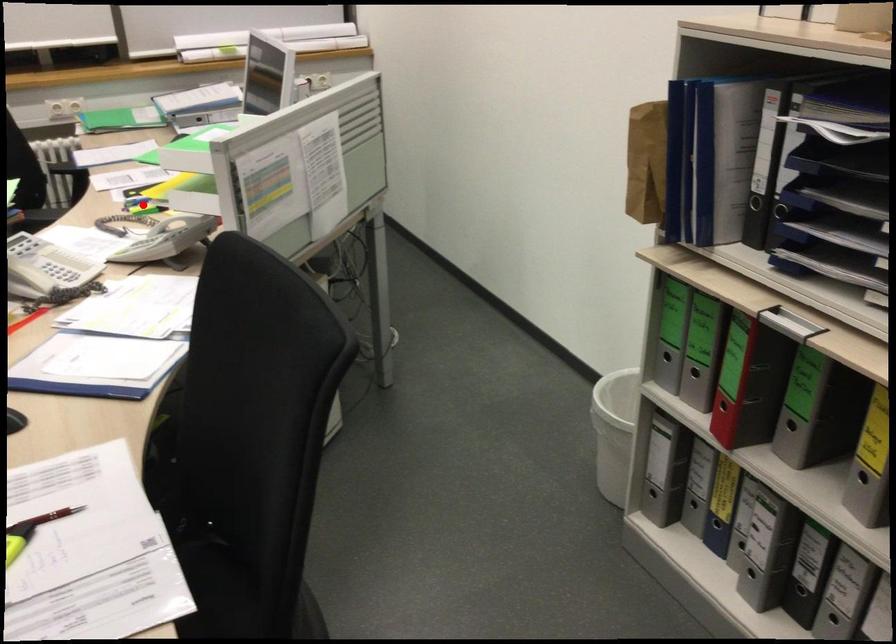
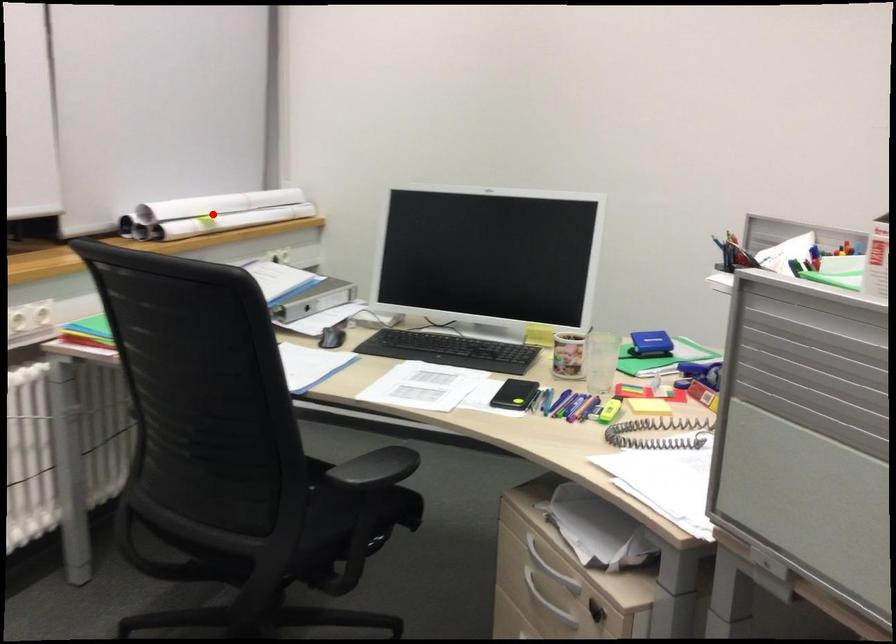
I am providing you with two images of the same scene from different viewpoints. A red point is marked on the first image and another point is marked on the second image. Do the highlighted points in image1 and image2 indicate the same real-world spot?

No